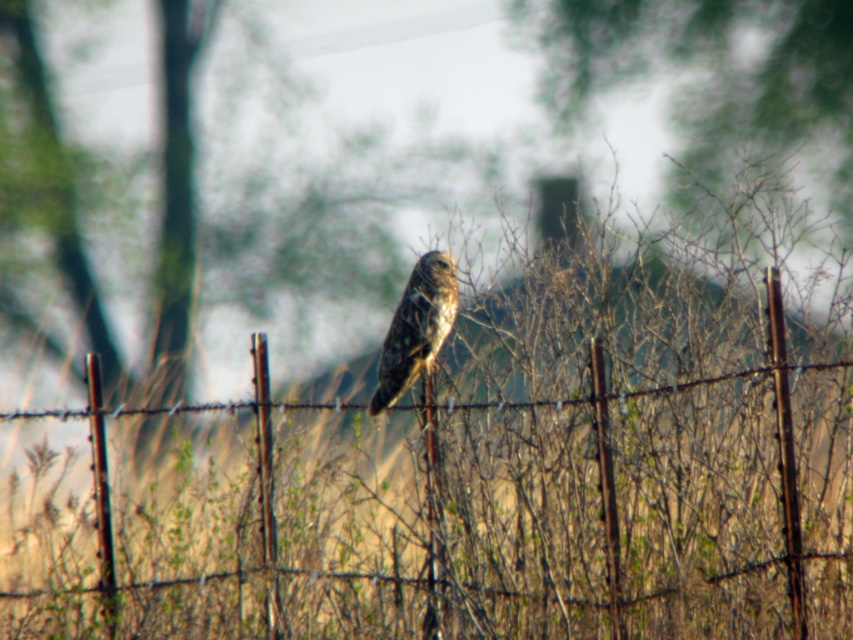
Question: Is rusty wire fence at center to the right of brown speckled owl at center from the viewer's perspective?

Choices:
 (A) yes
 (B) no

Answer: (A)

Question: Which point appears closest to the camera in this image?

Choices:
 (A) (401, 332)
 (B) (424, 461)

Answer: (A)

Question: Among these points, which one is nearest to the camera?

Choices:
 (A) (401, 374)
 (B) (654, 429)

Answer: (A)

Question: Is rusty wire fence at center to the left of brown speckled owl at center from the viewer's perspective?

Choices:
 (A) yes
 (B) no

Answer: (B)

Question: Can you confirm if rusty wire fence at center is wider than brown speckled owl at center?

Choices:
 (A) no
 (B) yes

Answer: (B)